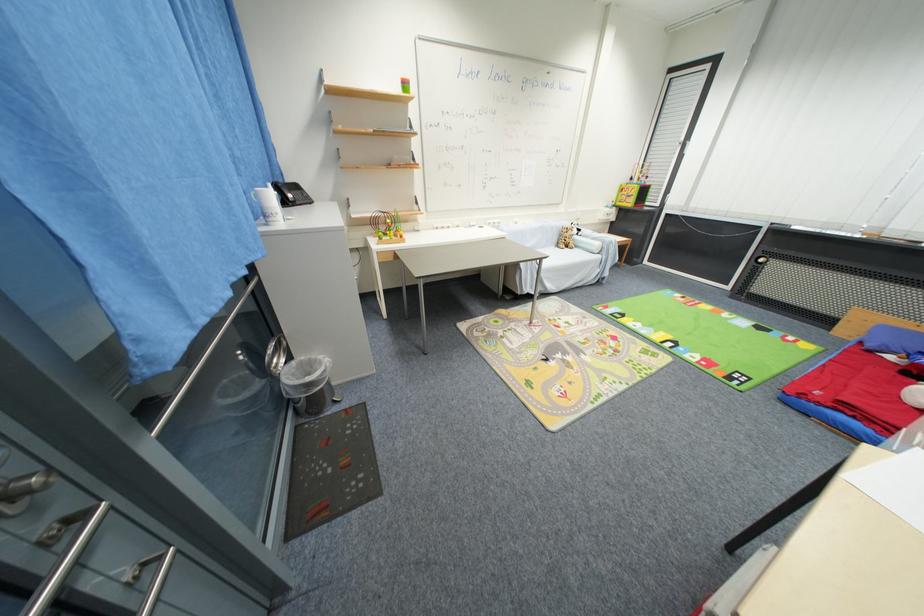
The image size is (924, 616). What do you see at coordinates (292, 193) in the screenshot?
I see `the telephone handset` at bounding box center [292, 193].